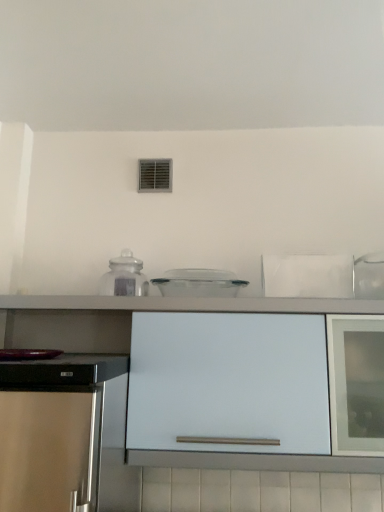
Question: Can you confirm if transparent glass jar at center, the 2th kitchen appliance when ordered from right to left, is smaller than white matte cabinet at center?

Choices:
 (A) yes
 (B) no

Answer: (A)

Question: From the image's perspective, is transparent glass jar at center, the 2th kitchen appliance when ordered from right to left, above white matte cabinet at center?

Choices:
 (A) no
 (B) yes

Answer: (B)

Question: Is transparent glass jar at center, the first kitchen appliance positioned from the left, located outside white matte cabinet at center?

Choices:
 (A) no
 (B) yes

Answer: (B)

Question: From a real-world perspective, does transparent glass jar at center, the first kitchen appliance positioned from the left, sit lower than white matte cabinet at center?

Choices:
 (A) no
 (B) yes

Answer: (A)

Question: Is transparent glass jar at center, the first kitchen appliance positioned from the left, positioned with its back to white matte cabinet at center?

Choices:
 (A) no
 (B) yes

Answer: (A)

Question: Would you say transparent glass jar at center, the first kitchen appliance positioned from the left, contains white matte cabinet at center?

Choices:
 (A) no
 (B) yes

Answer: (A)

Question: Considering the relative sizes of transparent plastic container at center, the 2th kitchen appliance viewed from the left, and white matte cabinet at center in the image provided, is transparent plastic container at center, the 2th kitchen appliance viewed from the left, smaller than white matte cabinet at center?

Choices:
 (A) yes
 (B) no

Answer: (A)

Question: Does transparent plastic container at center, the 2th kitchen appliance viewed from the left, lie behind white matte cabinet at center?

Choices:
 (A) yes
 (B) no

Answer: (A)

Question: Is transparent plastic container at center, the 2th kitchen appliance viewed from the left, thinner than white matte cabinet at center?

Choices:
 (A) no
 (B) yes

Answer: (B)

Question: Is transparent plastic container at center, which is counted as the first kitchen appliance, starting from the right, to the left of white matte cabinet at center from the viewer's perspective?

Choices:
 (A) yes
 (B) no

Answer: (B)

Question: Does transparent plastic container at center, the 2th kitchen appliance viewed from the left, have a lesser height compared to white matte cabinet at center?

Choices:
 (A) yes
 (B) no

Answer: (A)

Question: From the image's perspective, is transparent plastic container at center, which is counted as the first kitchen appliance, starting from the right, located beneath white matte cabinet at center?

Choices:
 (A) yes
 (B) no

Answer: (B)

Question: Does transparent plastic container at center, the 2th kitchen appliance viewed from the left, have a greater height compared to transparent glass jar at center, the 2th kitchen appliance when ordered from right to left?

Choices:
 (A) no
 (B) yes

Answer: (A)